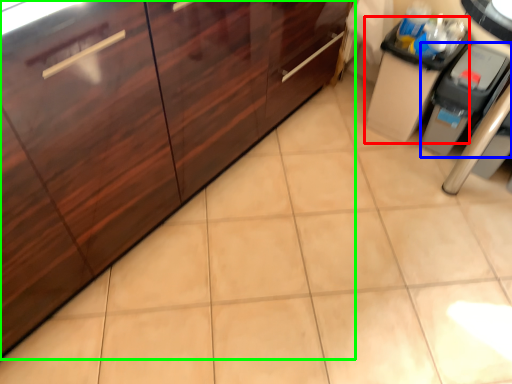
Question: Considering the real-world distances, which object is farthest from cabinetry (highlighted by a red box)? appliance (highlighted by a blue box) or cabinetry (highlighted by a green box)?

Choices:
 (A) appliance
 (B) cabinetry

Answer: (B)